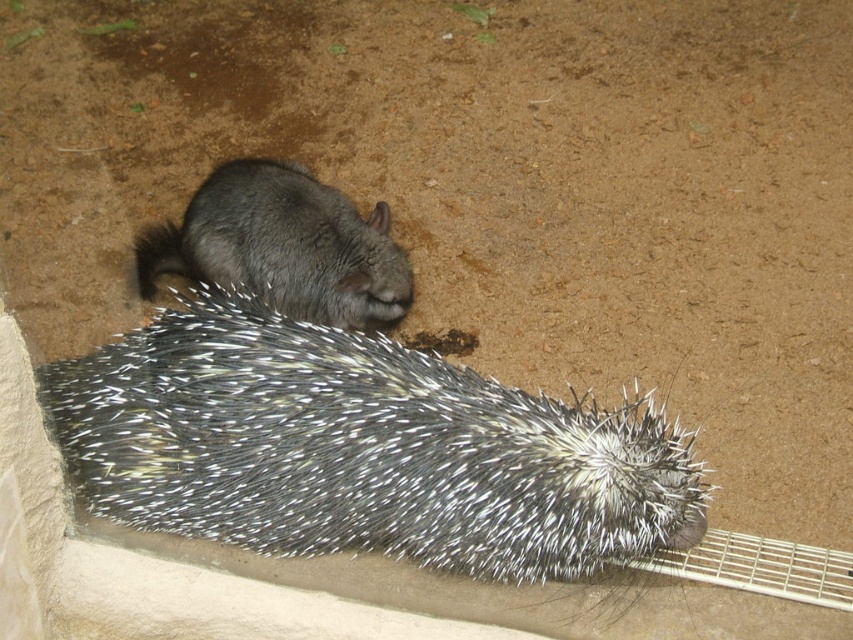
Does spiky fur hedgehog at lower left lie in front of gray furry rodent at center?

Yes, it is.

From the picture: Is the position of spiky fur hedgehog at lower left more distant than that of gray furry rodent at center?

No, it is not.

The width and height of the screenshot is (853, 640). What do you see at coordinates (361, 449) in the screenshot?
I see `spiky fur hedgehog at lower left` at bounding box center [361, 449].

What are the coordinates of `spiky fur hedgehog at lower left` in the screenshot? It's located at (361, 449).